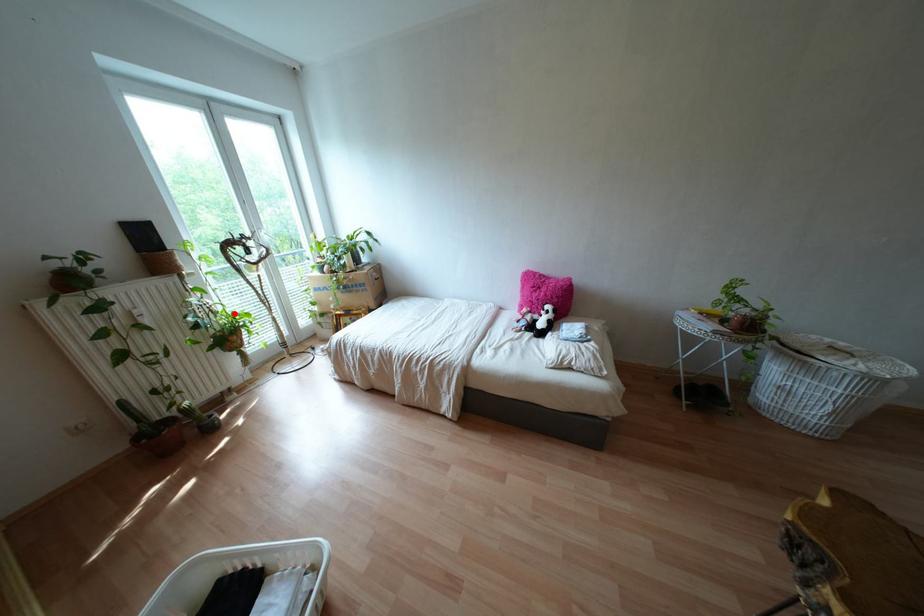
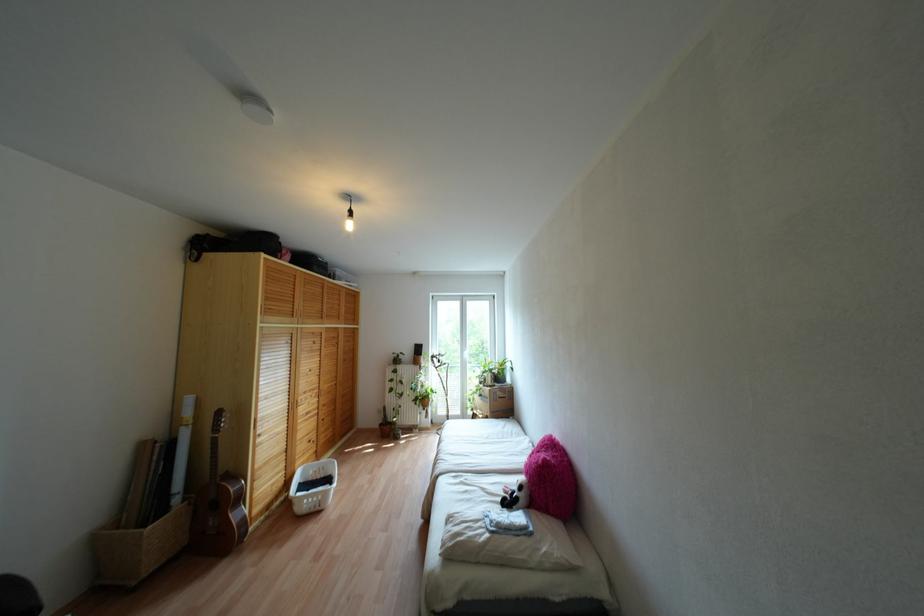
Locate, in the second image, the point that corresponds to the highlighted location in the first image.

(431, 389)